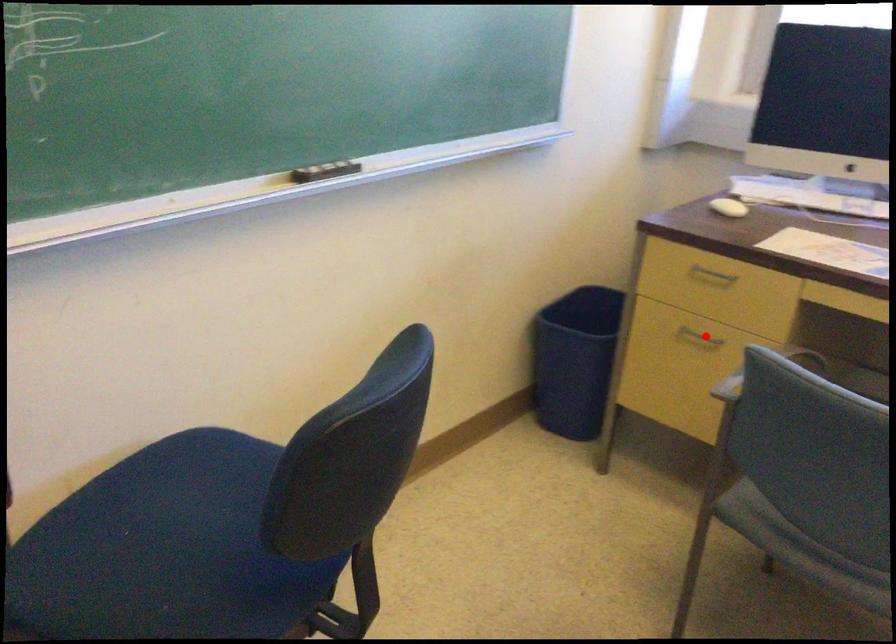
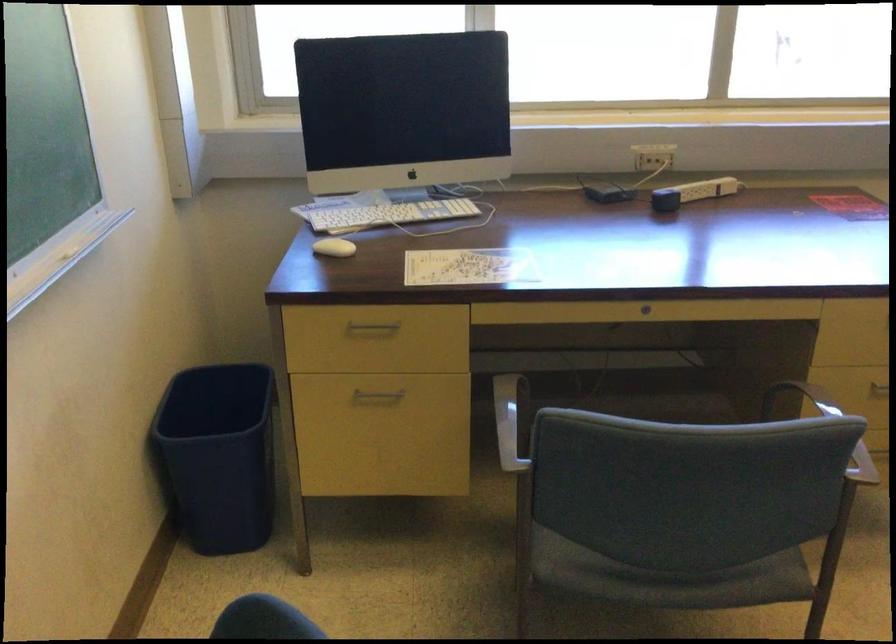
Question: I am providing you with two images of the same scene from different viewpoints. Given a red point in image1, look at the same physical point in image2. Is it:

Choices:
 (A) Closer to the viewpoint
 (B) Farther from the viewpoint

Answer: (A)